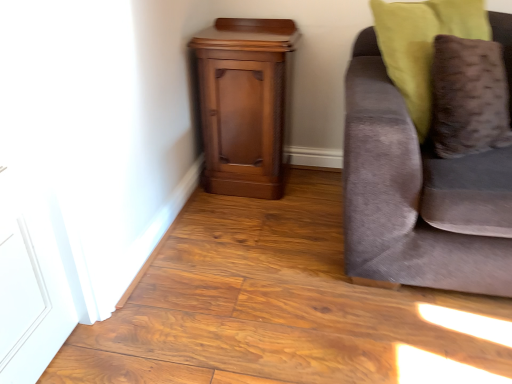
Question: Is point (239, 74) positioned closer to the camera than point (429, 24)?

Choices:
 (A) farther
 (B) closer

Answer: (A)

Question: From a real-world perspective, is polished wood nightstand at lower left physically located above or below velvet brown pillow at right?

Choices:
 (A) below
 (B) above

Answer: (A)

Question: Which of these objects is positioned closest to the velvet gray couch at right?

Choices:
 (A) velvet brown pillow at right
 (B) polished wood nightstand at lower left

Answer: (A)

Question: Considering the real-world distances, which object is farthest from the velvet brown pillow at right?

Choices:
 (A) polished wood nightstand at lower left
 (B) velvet gray couch at right

Answer: (A)